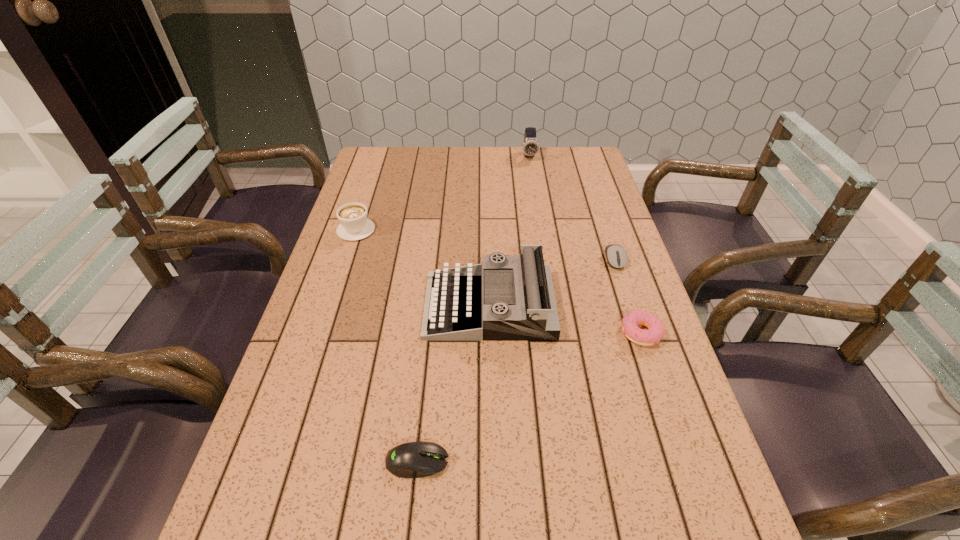
The width and height of the screenshot is (960, 540). Identify the location of object positioned at the left edge. (354, 225).

Find the location of `doughnut located at the right edge`. doughnut located at the right edge is located at coordinates (630, 322).

Find the location of a particular element. Image resolution: width=960 pixels, height=540 pixels. computer equipment that is at the right edge is located at coordinates (616, 256).

Locate an element on the screen. blank area at the far edge is located at coordinates (520, 171).

The height and width of the screenshot is (540, 960). In the image, there is a desktop. Find the location of `vacant space at the left edge`. vacant space at the left edge is located at coordinates (274, 398).

Where is `blank space at the right edge of the desktop`? blank space at the right edge of the desktop is located at coordinates (598, 261).

Locate an element on the screen. The height and width of the screenshot is (540, 960). vacant area that lies between the farthest object and the fifth nearest object is located at coordinates [443, 193].

Identify the location of unoccupied position between the third farthest object and the farthest object. (572, 208).

The width and height of the screenshot is (960, 540). What are the coordinates of `free space between the leftmost object and the farther computer mouse` in the screenshot? It's located at (486, 245).

Identify the location of free point between the watch and the doughnut. (586, 245).